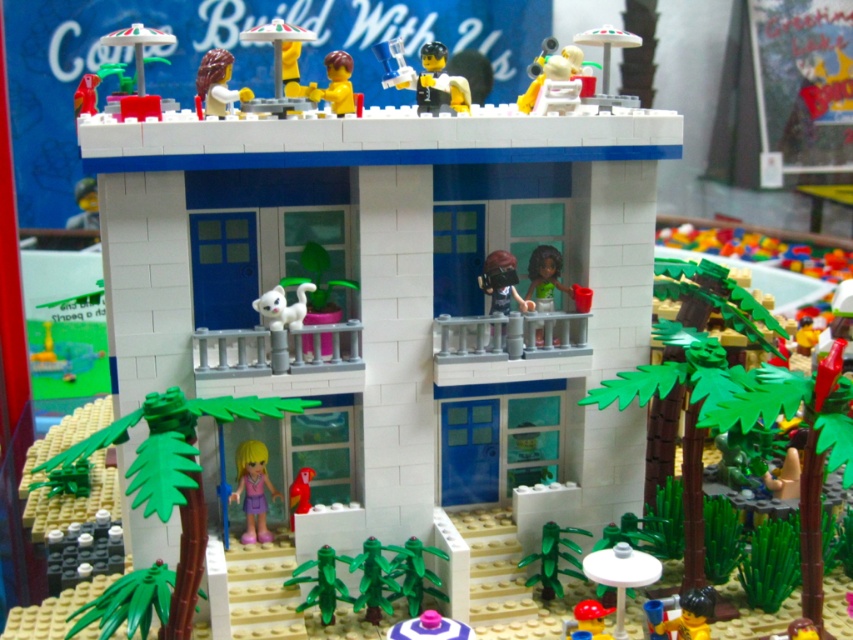
Question: Which point is closer to the camera?

Choices:
 (A) pos(384,84)
 (B) pos(482,282)
 (C) pos(685,612)

Answer: (C)

Question: Is yellow matte umbrella at upper center closer to the viewer compared to smooth red parrot at lower center?

Choices:
 (A) no
 (B) yes

Answer: (B)

Question: Estimate the real-world distances between objects in this image. Which object is farther from the smooth yellow minifigure at center?

Choices:
 (A) yellow matte umbrella at upper center
 (B) green translucent plastic plant at lower center
 (C) smooth red parrot at lower center
 (D) smooth plastic duck at lower center

Answer: (D)

Question: Is yellow matte umbrella at upper center further to the viewer compared to smooth plastic minifigure at lower right?

Choices:
 (A) yes
 (B) no

Answer: (A)

Question: Does brown matte helmet at upper center come in front of green matte figure at upper right?

Choices:
 (A) yes
 (B) no

Answer: (A)

Question: Which point appears farthest from the camera in this image?

Choices:
 (A) (432, 49)
 (B) (595, 628)

Answer: (A)